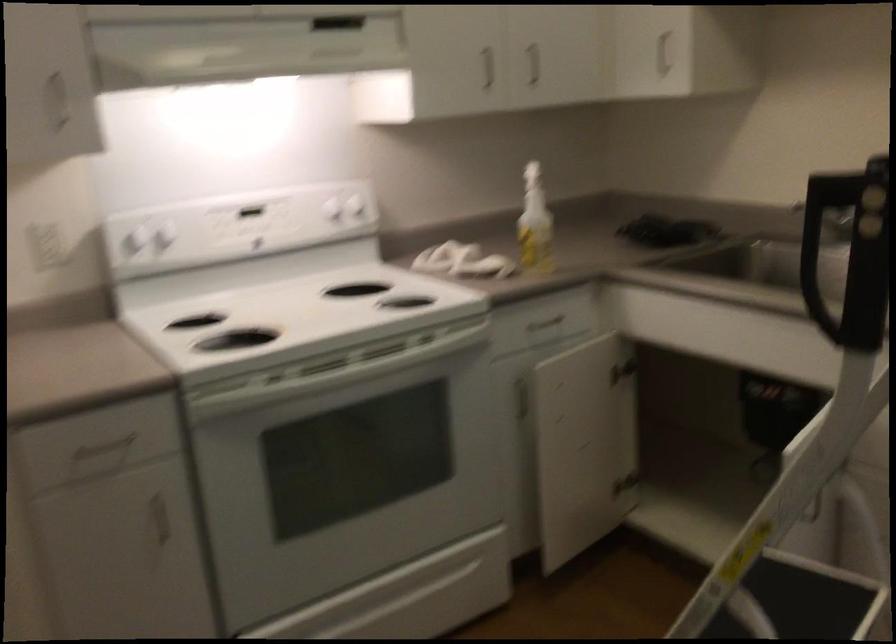
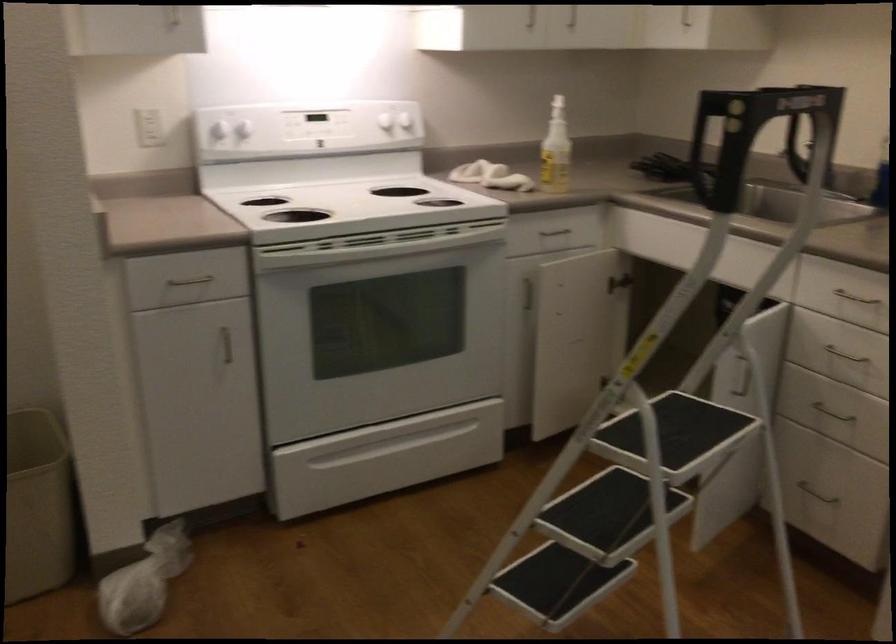
Find the pixel in the second image that matches [143,251] in the first image.

(221, 133)